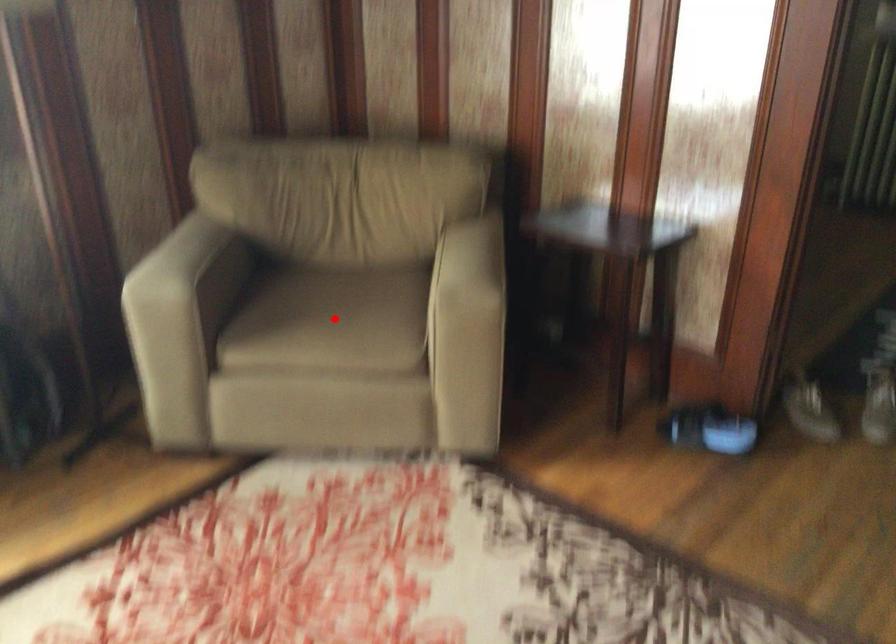
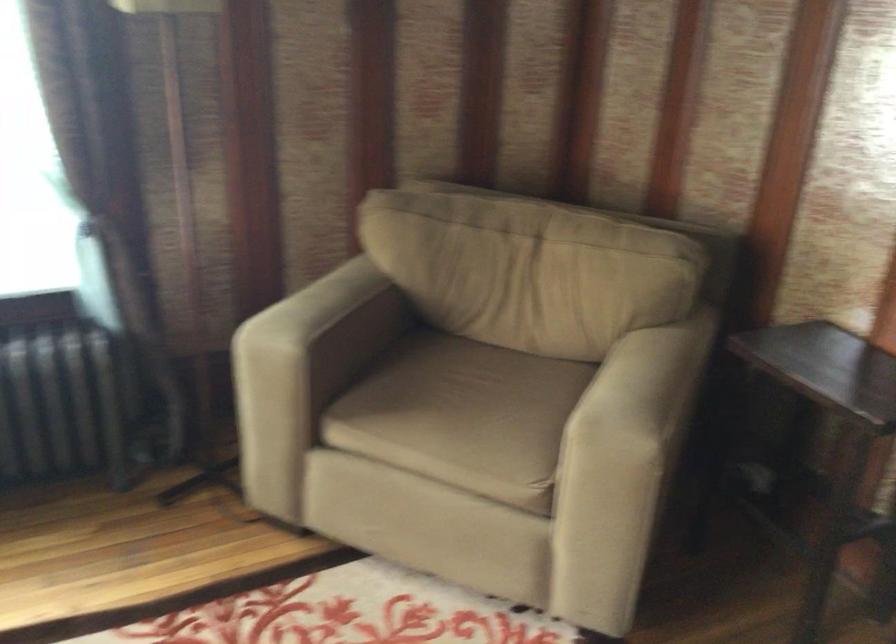
Question: I am providing you with two images of the same scene from different viewpoints. Given a red point in image1, look at the same physical point in image2. Is it:

Choices:
 (A) Closer to the viewpoint
 (B) Farther from the viewpoint

Answer: (A)